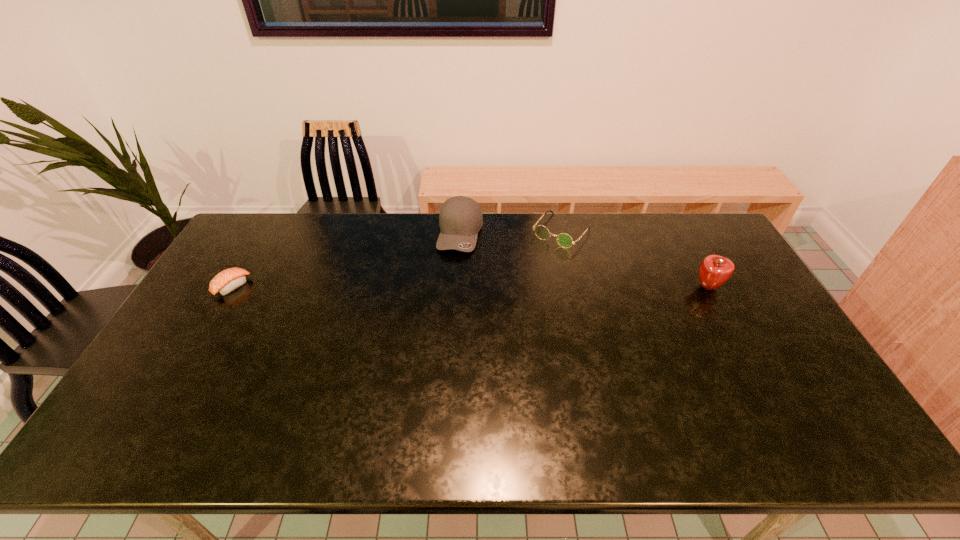
Locate an element on the screen. vacant spot on the desktop that is between the leftmost object and the rightmost object and is positioned on the front brim of the second object from left to right is located at coordinates (452, 287).

Image resolution: width=960 pixels, height=540 pixels. What are the coordinates of `free spot on the desktop that is between the sushi and the apple and is positioned on the lenses of the spectacles` in the screenshot? It's located at (517, 287).